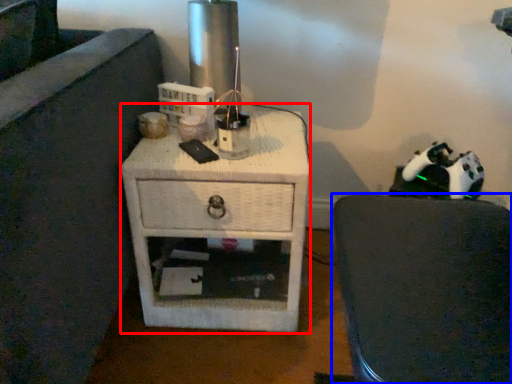
Question: Which object is further to the camera taking this photo, nightstand (highlighted by a red box) or furniture (highlighted by a blue box)?

Choices:
 (A) nightstand
 (B) furniture

Answer: (A)